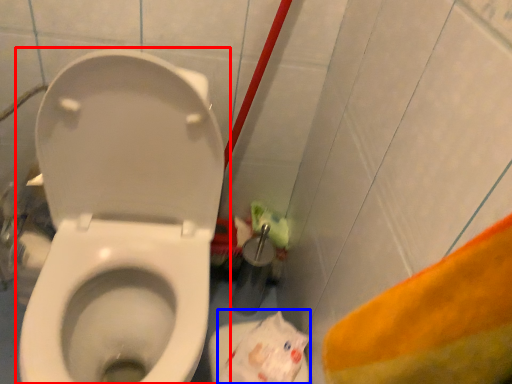
Question: Which of the following is the farthest to the observer, toilet (highlighted by a red box) or paper bag (highlighted by a blue box)?

Choices:
 (A) toilet
 (B) paper bag

Answer: (B)